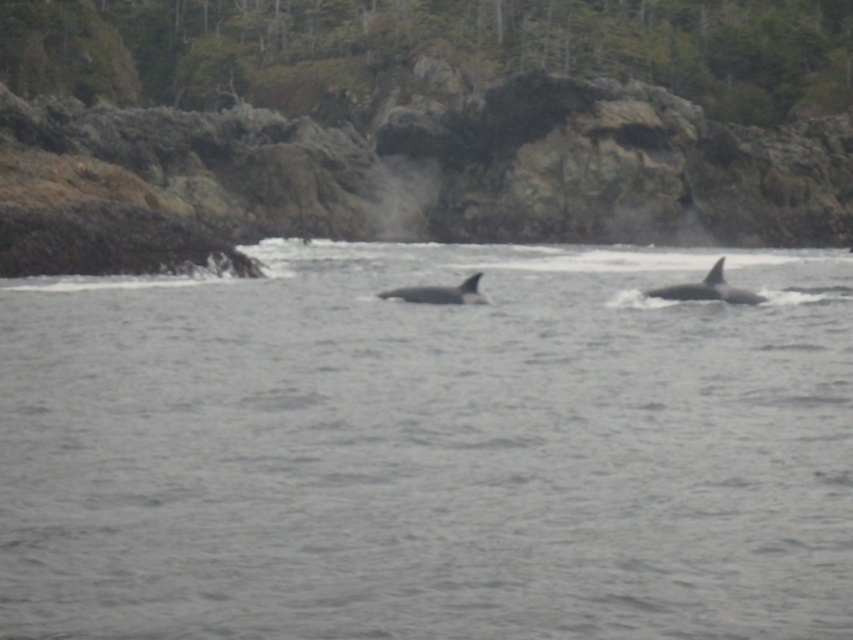
Which is below, black smooth whale at right or black smooth whale at center?

black smooth whale at center is lower down.

Is point (757, 296) farther from viewer compared to point (468, 284)?

Yes.

Is point (695, 284) farther from camera compared to point (422, 285)?

No, it is in front of (422, 285).

The width and height of the screenshot is (853, 640). I want to click on black smooth whale at right, so click(x=706, y=289).

You are a GUI agent. You are given a task and a screenshot of the screen. Output one action in this format:
    pyautogui.click(x=<x>, y=<y>)
    Task: Click on the gray water at center
    
    Given the screenshot: What is the action you would take?
    pyautogui.click(x=428, y=449)

Is point (654, 570) positioned in front of point (747, 298)?

Yes, it is.

Find the location of a particular element. Image resolution: width=853 pixels, height=640 pixels. gray water at center is located at coordinates (428, 449).

Is gray water at center to the left of black smooth whale at center from the viewer's perspective?

Incorrect, gray water at center is not on the left side of black smooth whale at center.

This screenshot has width=853, height=640. Describe the element at coordinates (428, 449) in the screenshot. I see `gray water at center` at that location.

Is point (537, 284) more distant than point (386, 292)?

Yes, point (537, 284) is behind point (386, 292).

This screenshot has height=640, width=853. I want to click on gray water at center, so click(x=428, y=449).